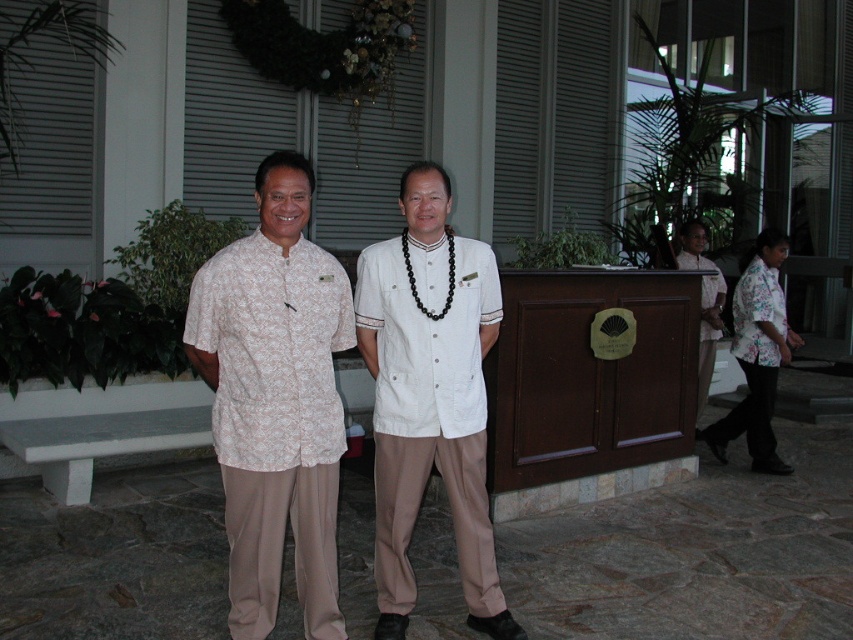
Question: Which of these objects is positioned closest to the floral shirt at right?

Choices:
 (A) white floral shirt at center
 (B) white matte shirt at center
 (C) white fabric blouse at right

Answer: (C)

Question: Which point is closer to the camera taking this photo?

Choices:
 (A) (705, 364)
 (B) (231, 616)
 (C) (715, 442)
 (D) (460, 323)

Answer: (B)

Question: Does floral shirt at right appear over white fabric blouse at right?

Choices:
 (A) yes
 (B) no

Answer: (B)

Question: Can you confirm if white matte shirt at center is positioned to the left of white fabric blouse at right?

Choices:
 (A) no
 (B) yes

Answer: (B)

Question: Is white floral shirt at center further to the viewer compared to white fabric blouse at right?

Choices:
 (A) no
 (B) yes

Answer: (A)

Question: Which object is farther from the camera taking this photo?

Choices:
 (A) floral shirt at right
 (B) white floral shirt at center

Answer: (A)